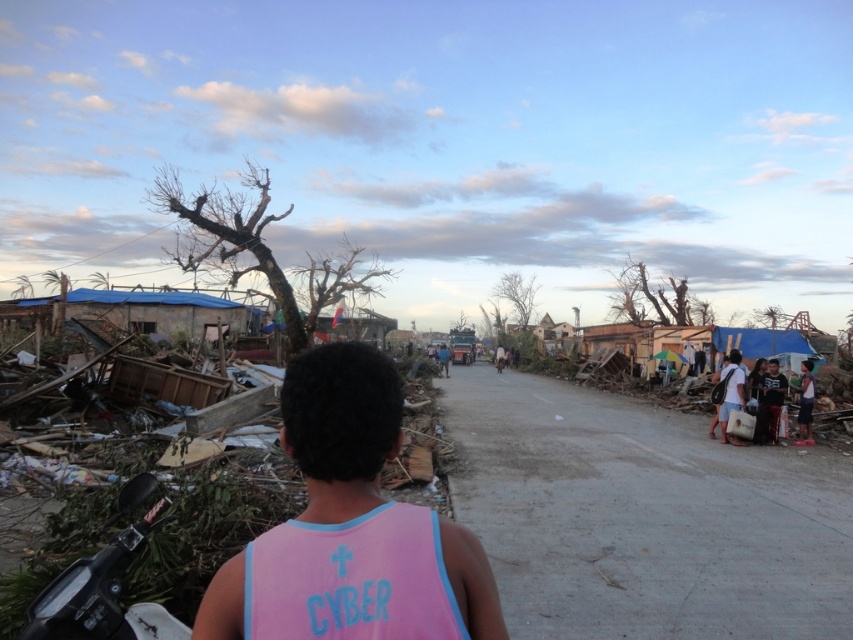
You are a relief worker in the disaster area. You see a dark gray shirt at right and a brown rough tree at left. Which object is located to the east of the other?

The dark gray shirt at right is positioned on the right side of brown rough tree at left, so the dark gray shirt at right is located to the east of the brown rough tree at left.

You are a rescue worker trying to reach the point marked at coordinates (x=761, y=394) in the image. Your current position is 10 meters away from the viewer. Can you safely reach that point without exceeding your 12 meter operational range?

The point at (x=761, y=394) is 11.71 meters away from the viewer. Since you are currently 10 meters away from the viewer, the total distance to the point would be 11.71 meters minus your current distance of 10 meters, resulting in 1.71 meters. This is well within your 12 meter operational range, so you can safely reach the point.

You are a photographer trying to capture both the pink fabric shirt at center and the blue fabric shirt at center in a single frame. Given their sizes, which shirt will appear smaller in the photo?

The pink fabric shirt at center occupies less space than the blue fabric shirt at center, so it will appear smaller in the photo.